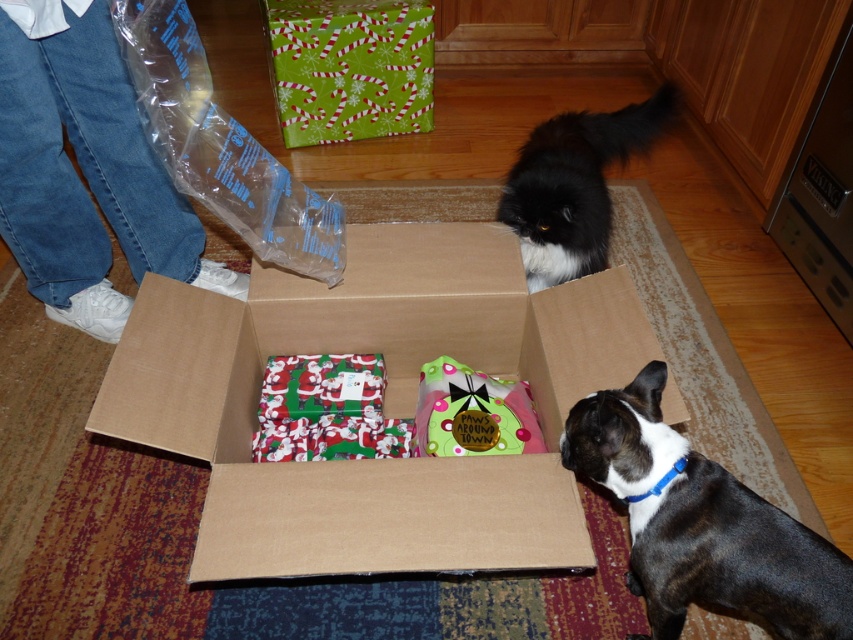
Which is above, brown cardboard box at center or black smooth dog at lower right?

brown cardboard box at center is higher up.

Is point (331, 294) in front of point (677, 477)?

No, (331, 294) is behind (677, 477).

The width and height of the screenshot is (853, 640). In order to click on brown cardboard box at center in this screenshot , I will do `click(384, 403)`.

Is point (743, 492) farther from camera compared to point (515, 228)?

No, (743, 492) is closer to viewer.

Based on the photo, is black smooth dog at lower right to the left of black fluffy cat at upper center from the viewer's perspective?

Correct, you'll find black smooth dog at lower right to the left of black fluffy cat at upper center.

Which is in front, point (654, 412) or point (535, 182)?

Point (654, 412) is in front.

You are a GUI agent. You are given a task and a screenshot of the screen. Output one action in this format:
    pyautogui.click(x=<x>, y=<y>)
    Task: Click on the black smooth dog at lower right
    This screenshot has width=853, height=640.
    Given the screenshot: What is the action you would take?
    pyautogui.click(x=701, y=524)

Does point (326, 74) lie behind point (308, 364)?

Yes, it is behind point (308, 364).

Describe the element at coordinates (349, 67) in the screenshot. I see `green paper wrapped gift at center` at that location.

This screenshot has height=640, width=853. Identify the location of green paper wrapped gift at center. (349, 67).

You are a GUI agent. You are given a task and a screenshot of the screen. Output one action in this format:
    pyautogui.click(x=<x>, y=<y>)
    Task: Click on the green paper wrapped gift at center
    
    Given the screenshot: What is the action you would take?
    pyautogui.click(x=349, y=67)